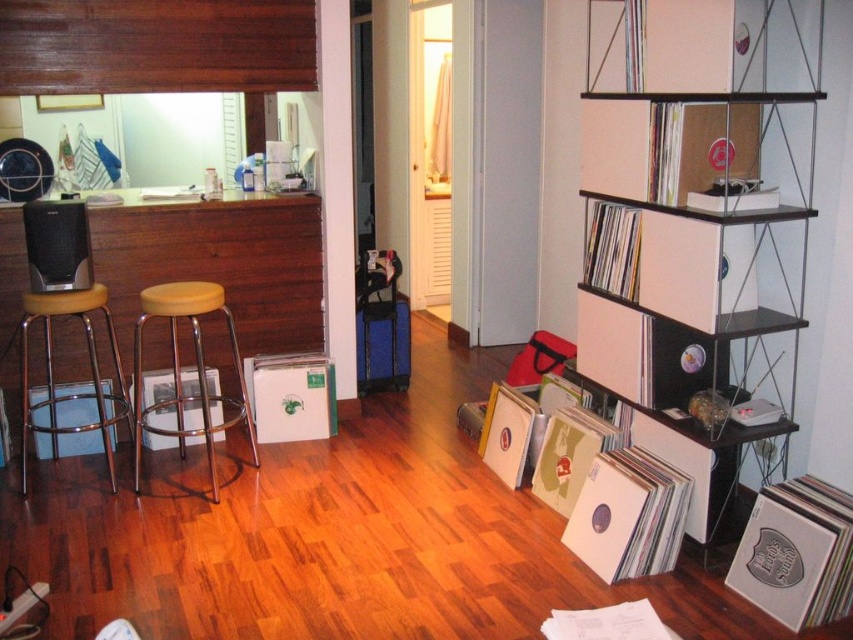
Question: Estimate the real-world distances between objects in this image. Which object is farther from the brown wood stool at left?

Choices:
 (A) metallic silver bookshelf at right
 (B) white plastic shelf at upper right
 (C) metallic yellow bar stool at left

Answer: (B)

Question: Does metallic silver bookshelf at right come behind yellow matte bar stool at left?

Choices:
 (A) yes
 (B) no

Answer: (B)

Question: Is brown wood stool at left further to the viewer compared to metallic yellow bar stool at left?

Choices:
 (A) yes
 (B) no

Answer: (A)

Question: Can you confirm if yellow matte bar stool at left is positioned to the right of matte black speaker at left?

Choices:
 (A) yes
 (B) no

Answer: (A)

Question: Which object is the farthest from the yellow matte bar stool at left?

Choices:
 (A) brown wood stool at left
 (B) white cardboard shelf at upper right
 (C) matte black speaker at left
 (D) white plastic shelf at upper right

Answer: (B)

Question: Which point is closer to the camera taking this photo?

Choices:
 (A) (120, 328)
 (B) (612, 300)

Answer: (B)